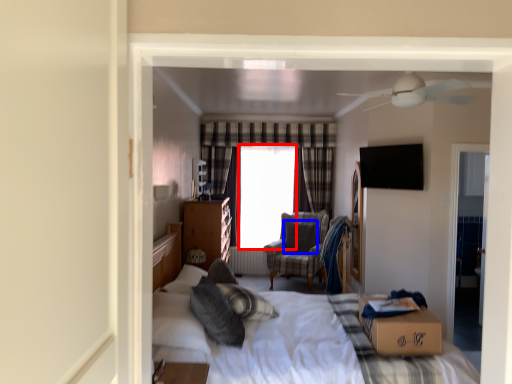
Question: Which object is further to the camera taking this photo, window screen (highlighted by a red box) or pillow (highlighted by a blue box)?

Choices:
 (A) window screen
 (B) pillow

Answer: (A)